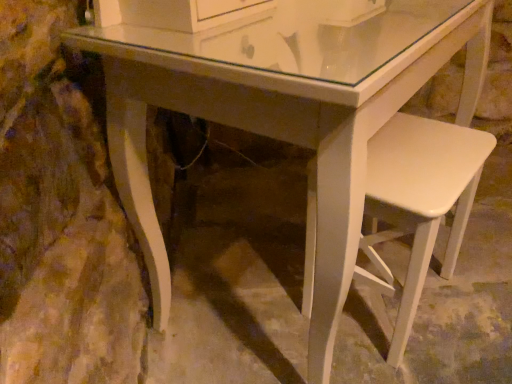
Find the location of a particular element. Image resolution: width=512 pixels, height=384 pixels. vacant area to the right of white matte wood bar stool at lower right is located at coordinates (478, 292).